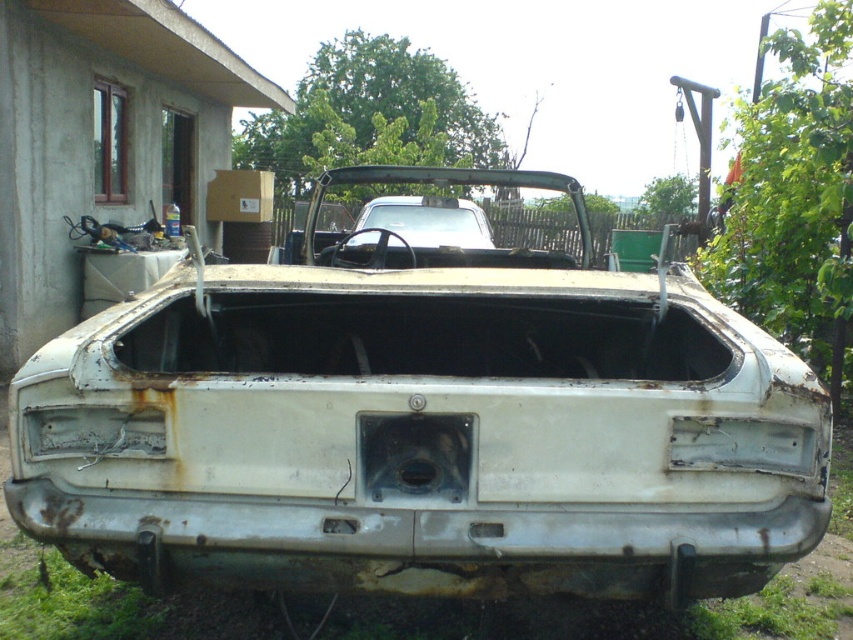
Can you confirm if rusty metal car at center is shorter than white matte car at center?

No.

Can you confirm if rusty metal car at center is positioned to the left of white matte car at center?

Incorrect, rusty metal car at center is not on the left side of white matte car at center.

Is point (225, 449) positioned after point (364, 236)?

No, (225, 449) is in front of (364, 236).

The width and height of the screenshot is (853, 640). What are the coordinates of `rusty metal car at center` in the screenshot? It's located at (422, 422).